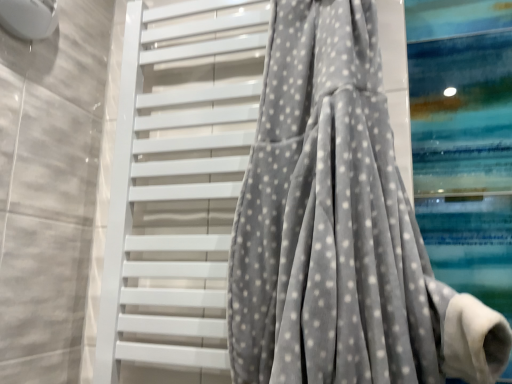
Question: Is point (302, 175) positioned closer to the camera than point (151, 369)?

Choices:
 (A) farther
 (B) closer

Answer: (B)

Question: Based on their sizes in the image, would you say gray velvety curtain at center is bigger or smaller than white matte towel rack at center?

Choices:
 (A) big
 (B) small

Answer: (A)

Question: Would you say gray velvety curtain at center is to the left or to the right of white matte towel rack at center in the picture?

Choices:
 (A) left
 (B) right

Answer: (B)

Question: Is white matte towel rack at center in front of or behind gray velvety curtain at center in the image?

Choices:
 (A) front
 (B) behind

Answer: (B)

Question: Considering the positions of white matte towel rack at center and gray velvety curtain at center in the image, is white matte towel rack at center wider or thinner than gray velvety curtain at center?

Choices:
 (A) wide
 (B) thin

Answer: (B)

Question: Would you say white matte towel rack at center is inside or outside gray velvety curtain at center?

Choices:
 (A) outside
 (B) inside

Answer: (A)

Question: In terms of height, does white matte towel rack at center look taller or shorter compared to gray velvety curtain at center?

Choices:
 (A) short
 (B) tall

Answer: (B)